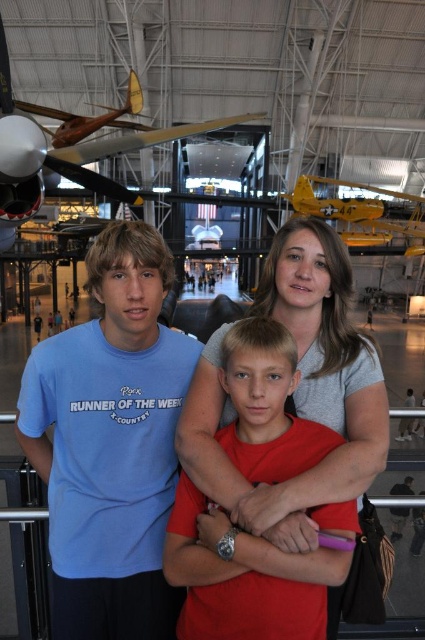
Question: Which point appears closest to the camera in this image?

Choices:
 (A) (319, 438)
 (B) (71, 481)
 (C) (339, 220)
 (D) (252, 115)

Answer: (A)

Question: Is wooden propeller plane at upper left behind yellow matte airplane at upper center?

Choices:
 (A) no
 (B) yes

Answer: (A)

Question: Which of the following is the farthest from the observer?

Choices:
 (A) (91, 614)
 (B) (380, 212)
 (C) (186, 557)
 (D) (36, 108)

Answer: (B)

Question: Does blue cotton t-shirt at left appear under wooden propeller plane at upper left?

Choices:
 (A) no
 (B) yes

Answer: (B)

Question: Is blue cotton t-shirt at left smaller than wooden propeller plane at upper left?

Choices:
 (A) no
 (B) yes

Answer: (B)

Question: Which object appears farthest from the camera in this image?

Choices:
 (A) wooden propeller plane at upper left
 (B) blue cotton t-shirt at left

Answer: (A)